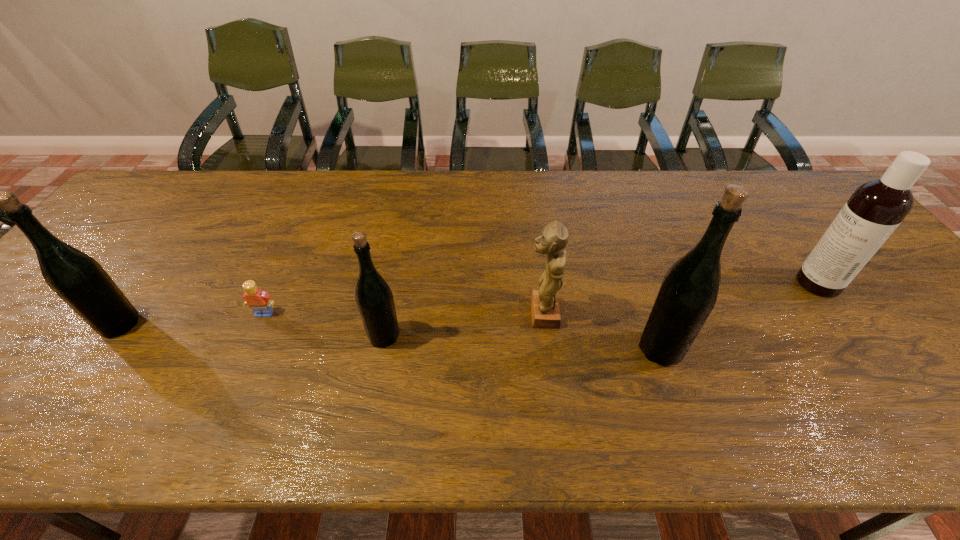
Find the location of a particular element. free space between the figurine and the fourth object from right to left is located at coordinates (463, 325).

Locate an element on the screen. Image resolution: width=960 pixels, height=540 pixels. vacant area that lies between the rightmost object and the fourth object from right to left is located at coordinates (601, 310).

Image resolution: width=960 pixels, height=540 pixels. What are the coordinates of `the closest object to the shortest object` in the screenshot? It's located at (374, 298).

Where is `object that ranks as the third closest to the second object from left to right`? Image resolution: width=960 pixels, height=540 pixels. object that ranks as the third closest to the second object from left to right is located at coordinates (553, 239).

Find the location of `beer bottle object that ranks as the second closest to the third object from right to left`. beer bottle object that ranks as the second closest to the third object from right to left is located at coordinates (374, 298).

This screenshot has width=960, height=540. I want to click on beer bottle that is the nearest to the figurine, so pyautogui.click(x=688, y=293).

This screenshot has width=960, height=540. Find the location of `vacant region that satisfies the following two spatial constraints: 1. on the label side of the rightmost object; 2. on the front side of the shortest beer bottle`. vacant region that satisfies the following two spatial constraints: 1. on the label side of the rightmost object; 2. on the front side of the shortest beer bottle is located at coordinates (856, 336).

What are the coordinates of `free space that satisfies the following two spatial constraints: 1. on the front-facing side of the fourth object from left to right; 2. on the right side of the rightmost beer bottle` in the screenshot? It's located at (546, 348).